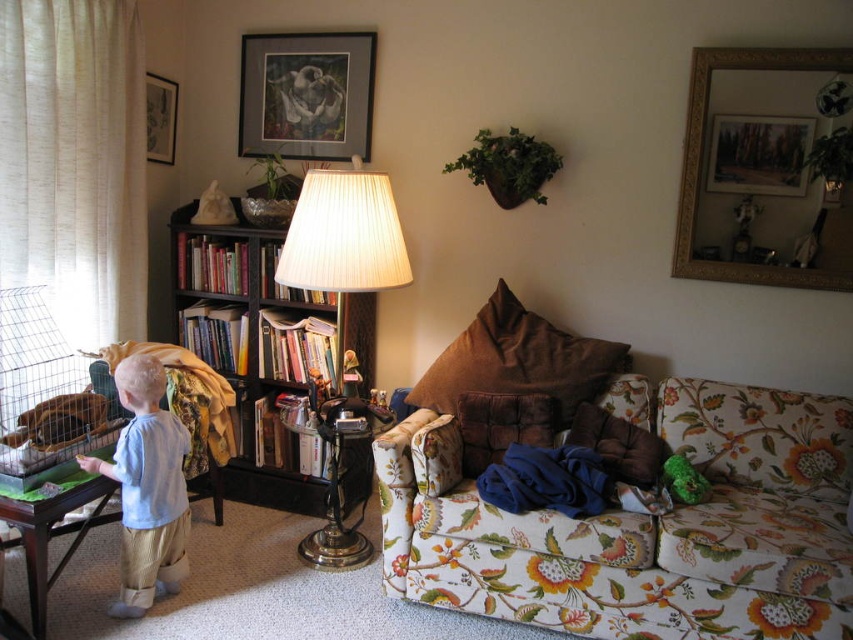
In the scene shown: You are standing at the point labeled point at (347, 342). You want to walk to the door that is 3.10 meters away from you. Is there enough space to walk straight to the door without any obstacles?

The distance between you and the door is 3.10 meters. Since there are no objects mentioned in the scene that would block your path, you can walk straight to the door without any obstacles.

You are a delivery person who needs to place a large package on the bookshelf. The package is taller than the light blue cotton shirt at lower left. Can you place the package on the black wood bookcase at left without removing any items?

The black wood bookcase at left is bigger than the light blue cotton shirt at lower left. Since the package is taller than the light blue cotton shirt at lower left, and the bookcase is bigger, it should be possible to place the package on the black wood bookcase at left without removing items.